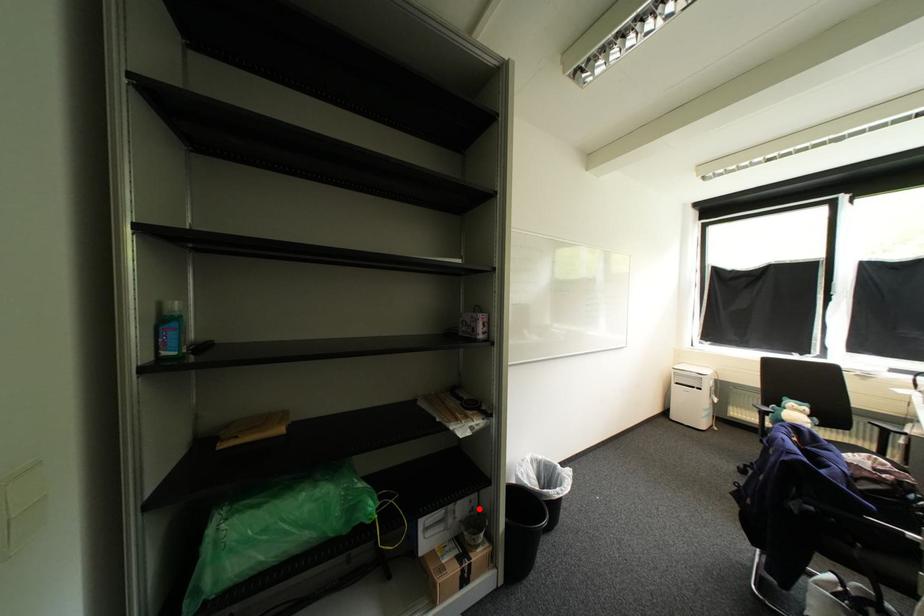
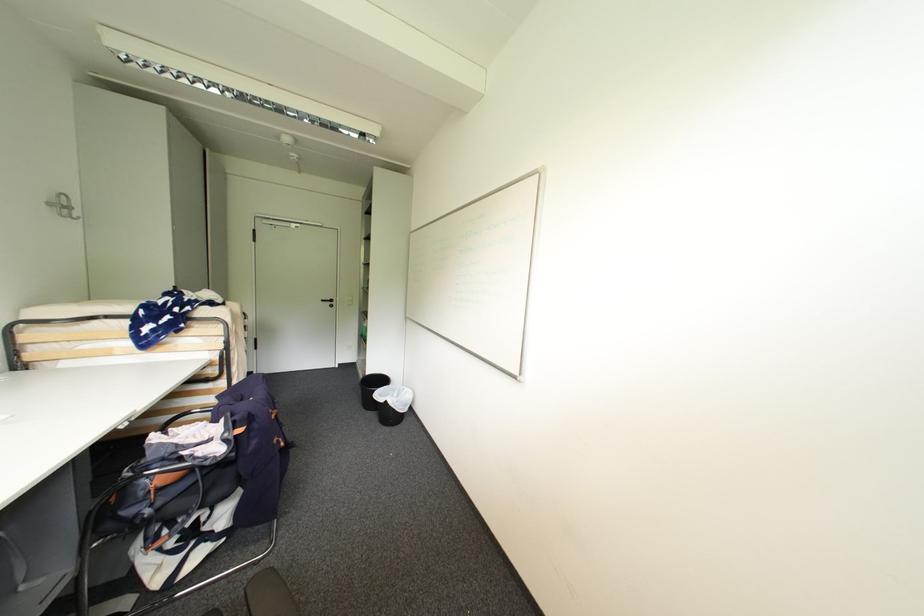
Question: I am providing you with two images of the same scene from different viewpoints. A red point is marked on the first image. At the location where the point appears in image 1, is it still visible in image 2?

Choices:
 (A) Yes
 (B) No

Answer: (B)